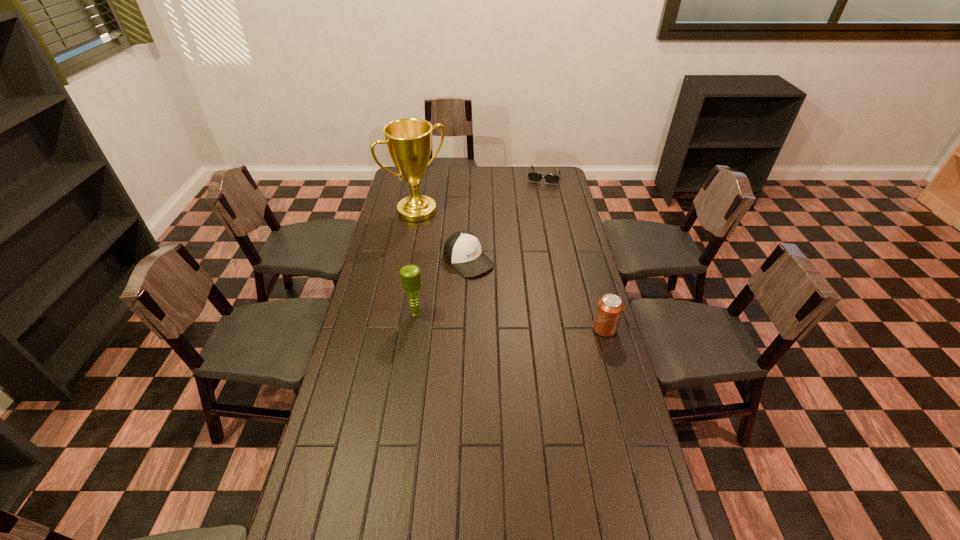
I want to click on vacant space on the desktop that is between the second tallest object and the third shortest object and is positioned on the front-facing side of the sunglasses, so [505, 321].

At what (x,y) coordinates should I click in order to perform the action: click on free space on the desktop that is between the microphone and the third tallest object and is positioned on the front panel of the third object from left to right. Please return your answer as a coordinate pair (x, y). The height and width of the screenshot is (540, 960). Looking at the image, I should click on (537, 323).

This screenshot has height=540, width=960. I want to click on vacant space on the desktop that is between the microphone and the third shortest object and is positioned by the handles of the fourth nearest object, so click(x=537, y=323).